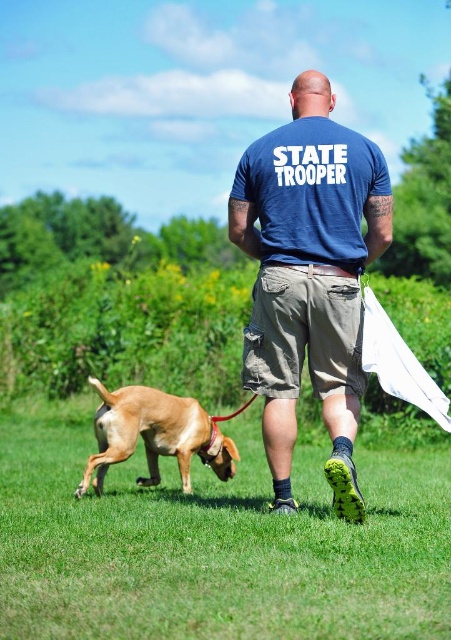
You are standing at the edge of the scene and want to step onto the green grass at lower center. Based on the coordinates provided, which direction should you move to reach it?

The green grass at lower center is located at coordinates point (216, 544), so you should move towards the lower center direction to reach it.

Where is the blue cotton shirt at center located in the image?

The blue cotton shirt at center is located at point (x=309, y=276).

You are standing at the point marked as point [289,214] in the image. You need to walk towards the man wearing a blue T shirt with STATE TROOPER on the back. How far will you have to walk to reach him?

The distance of point [289,214] from viewer is 5.50 meters, so you will have to walk 5.50 meters to reach the man wearing a blue T shirt with STATE TROOPER on the back.